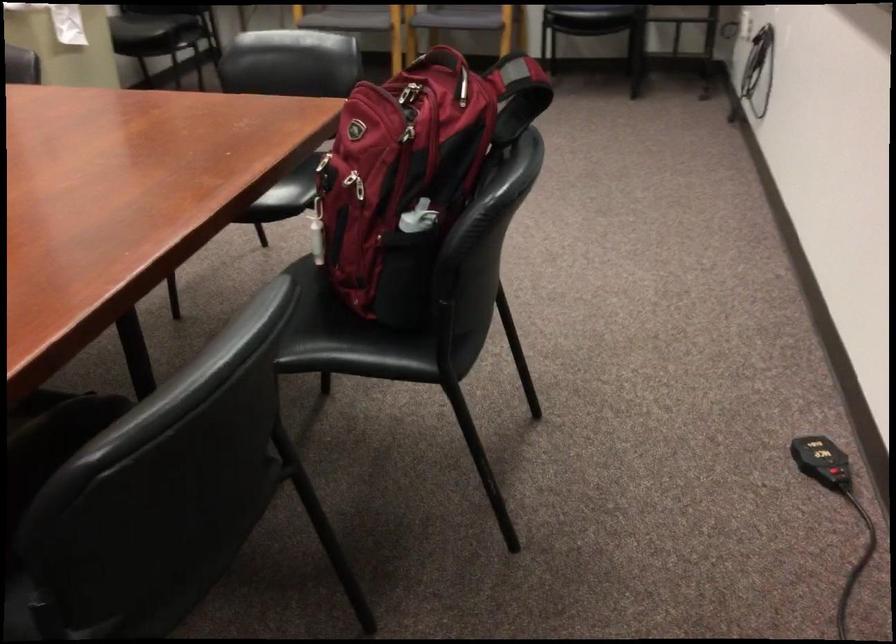
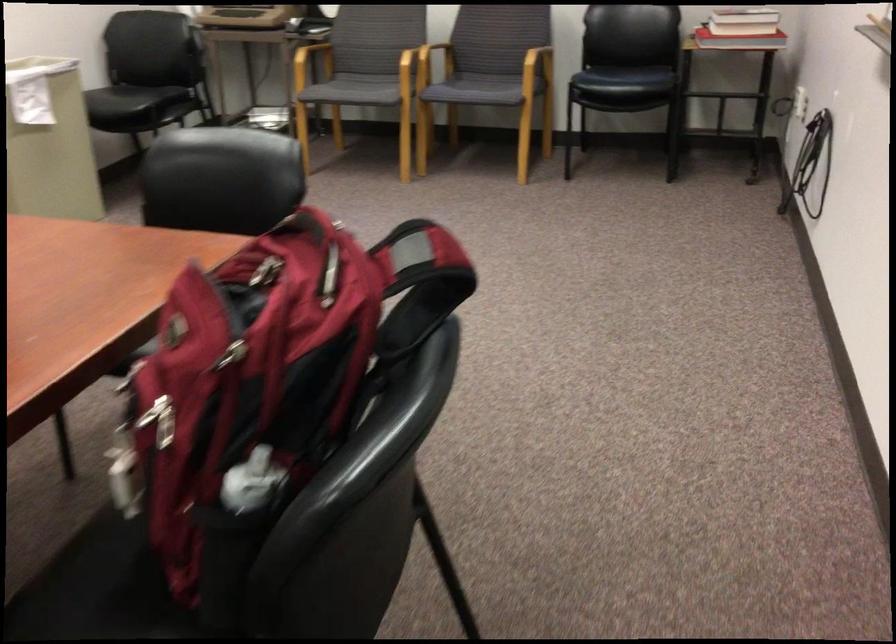
Which direction would the cameraman need to move to produce the second image?

The cameraman walked toward right, forward.